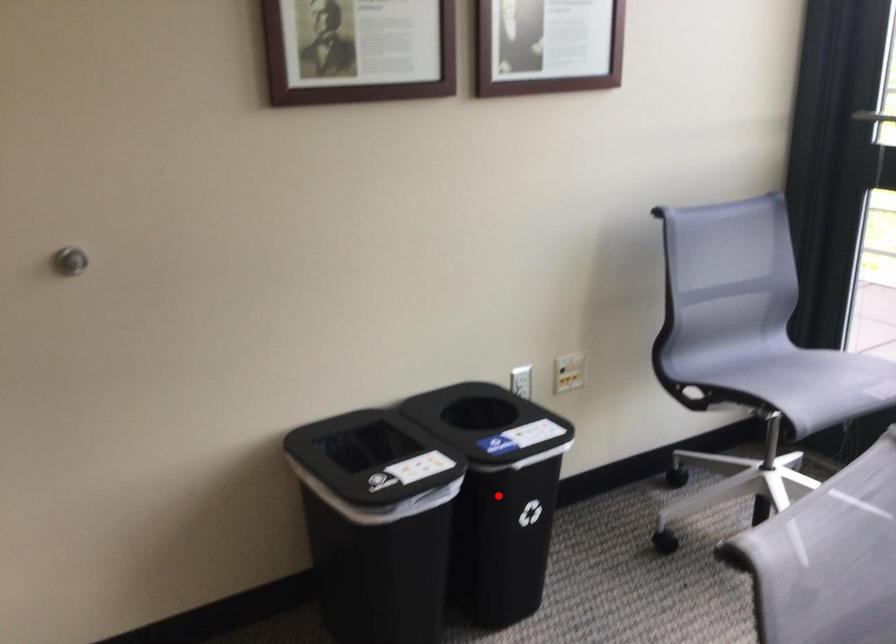
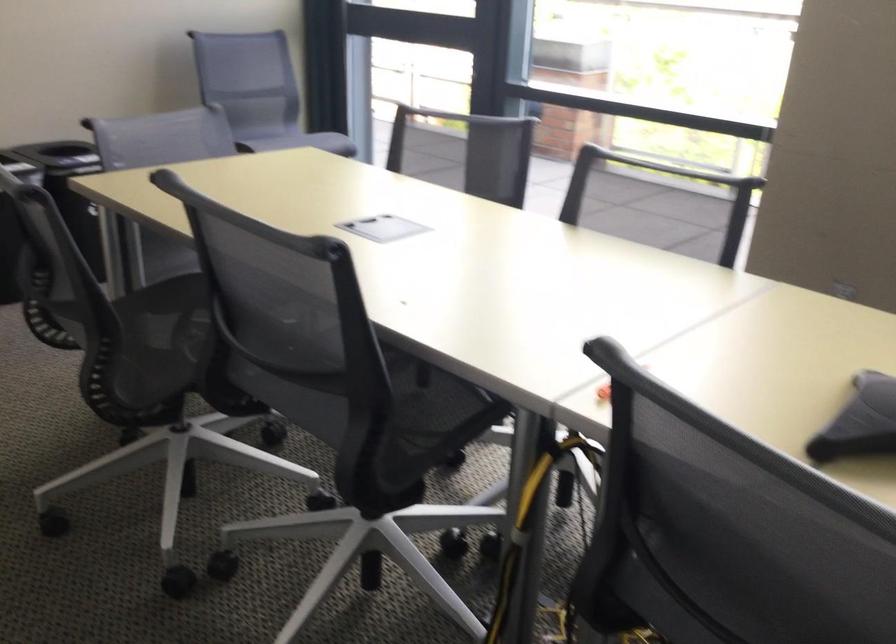
Question: I am providing you with two images of the same scene from different viewpoints. A red point is marked on the first image. At the location where the point appears in image 1, is it still visible in image 2?

Choices:
 (A) Yes
 (B) No

Answer: (B)